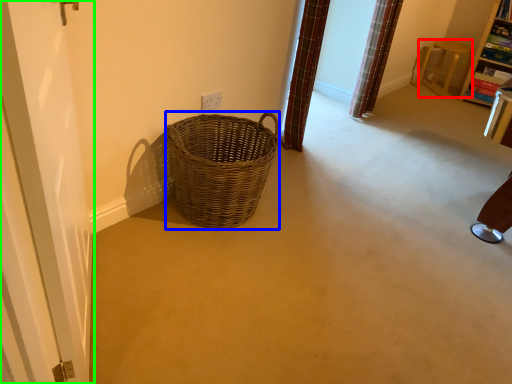
Question: Which object is positioned farthest from furniture (highlighted by a red box)? Select from basket (highlighted by a blue box) and screen door (highlighted by a green box).

Choices:
 (A) basket
 (B) screen door

Answer: (B)